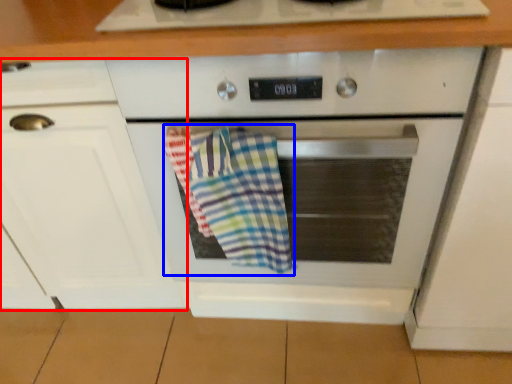
Question: Which of the following is the closest to the observer, cabinetry (highlighted by a red box) or beach towel (highlighted by a blue box)?

Choices:
 (A) cabinetry
 (B) beach towel

Answer: (A)